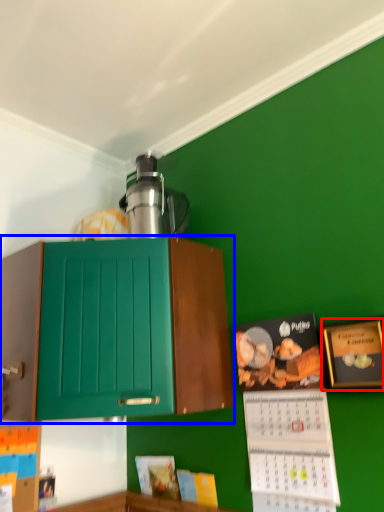
Question: Which of the following is the closest to the observer, picture frame (highlighted by a red box) or cabinetry (highlighted by a blue box)?

Choices:
 (A) picture frame
 (B) cabinetry

Answer: (B)